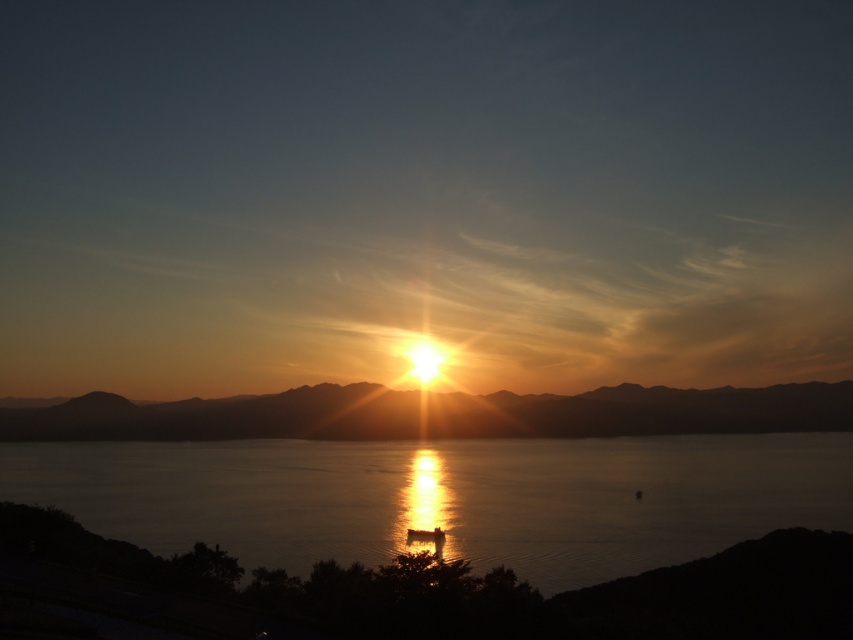
You are an artist trying to paint the sunset scene. You notice two areas of water reflecting the sunlight differently. Which area of water, the glistening reflective water at center or the golden reflective water at center, should you paint larger to accurately represent the scene?

The glistening reflective water at center should be painted larger because it is bigger than the golden reflective water at center according to the description.

You are an artist trying to paint the sunset scene. You notice two areas of water reflecting the sunset light differently. The first is described as glistening reflective water at center and the second as golden reflective water at center. Which of these two areas is narrower in width?

The glistening reflective water at center is narrower in width compared to the golden reflective water at center.

You are standing on the shore observing the sunset and notice two areas of water reflecting the sunlight differently. The first area is described as glistening reflective water at center, and the second is golden reflective water at center. Which of these two areas is farther from your current position?

The glistening reflective water at center is 121.41 meters away from the golden reflective water at center, so the glistening reflective water at center is farther away from your current position since it is positioned further back in the scene compared to the golden reflective water at center.